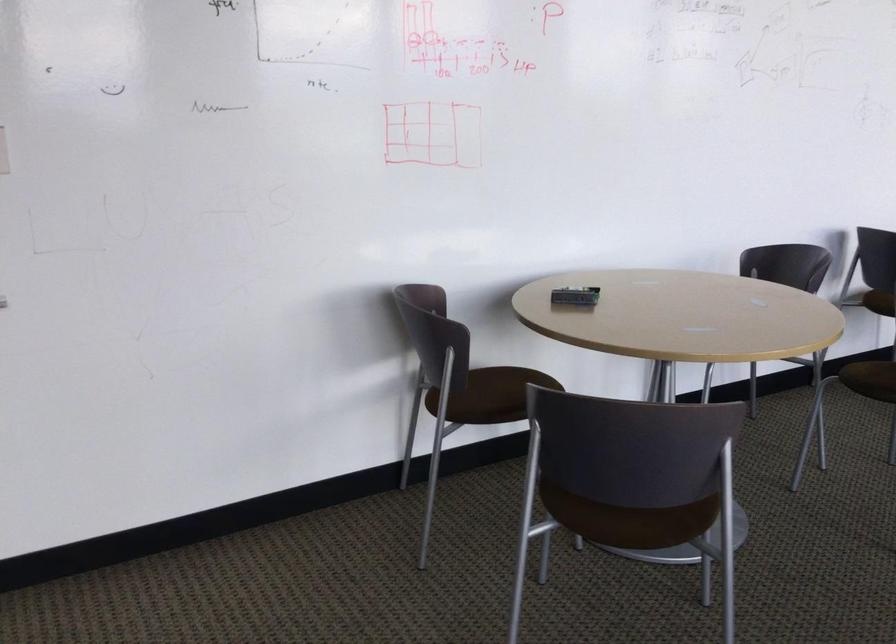
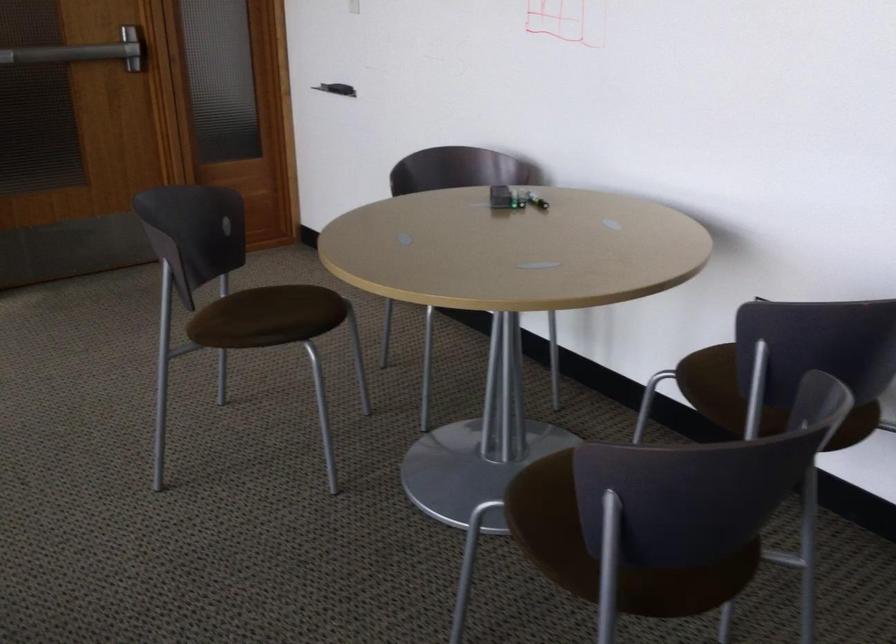
Question: I am providing you with two images of the same scene from different viewpoints. Which of the following objects are not visible in image2?

Choices:
 (A) green battery
 (B) brown chair sitting surface
 (C) chair sitting surface
 (D) silver metal handle

Answer: (C)